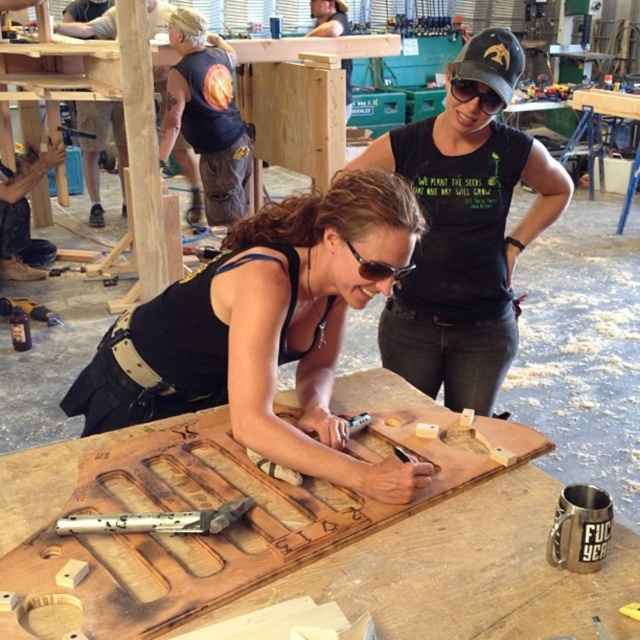
You are a visitor in the workshop and want to locate the black matte goggles at upper center. Where should you look relative to the sunglasses at center?

The black matte goggles at upper center are located to the right of the sunglasses at center.